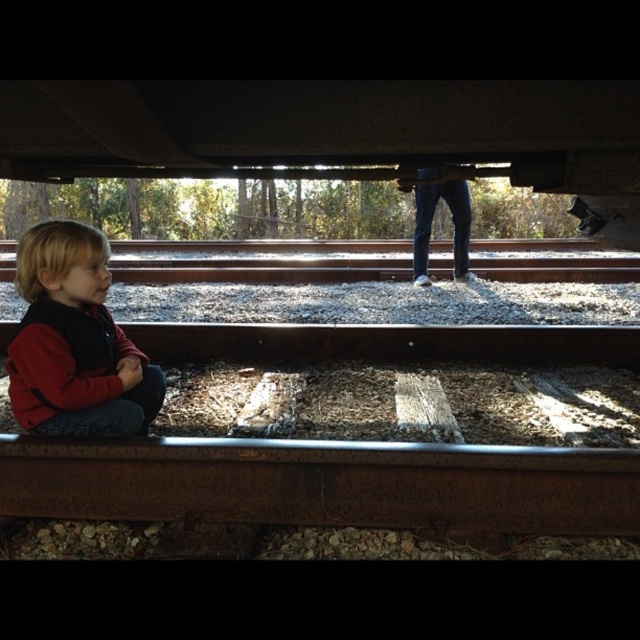
Question: Among these points, which one is farthest from the camera?

Choices:
 (A) (109, 528)
 (B) (113, 376)

Answer: (A)

Question: Which object is closer to the camera taking this photo?

Choices:
 (A) rusty metal train track at lower center
 (B) red fleece jacket at lower left

Answer: (B)

Question: Is rusty metal train track at lower center bigger than red fleece jacket at lower left?

Choices:
 (A) yes
 (B) no

Answer: (A)

Question: Can you confirm if rusty metal train track at lower center is positioned above red fleece jacket at lower left?

Choices:
 (A) no
 (B) yes

Answer: (A)

Question: Is rusty metal train track at lower center further to the viewer compared to red fleece jacket at lower left?

Choices:
 (A) no
 (B) yes

Answer: (B)